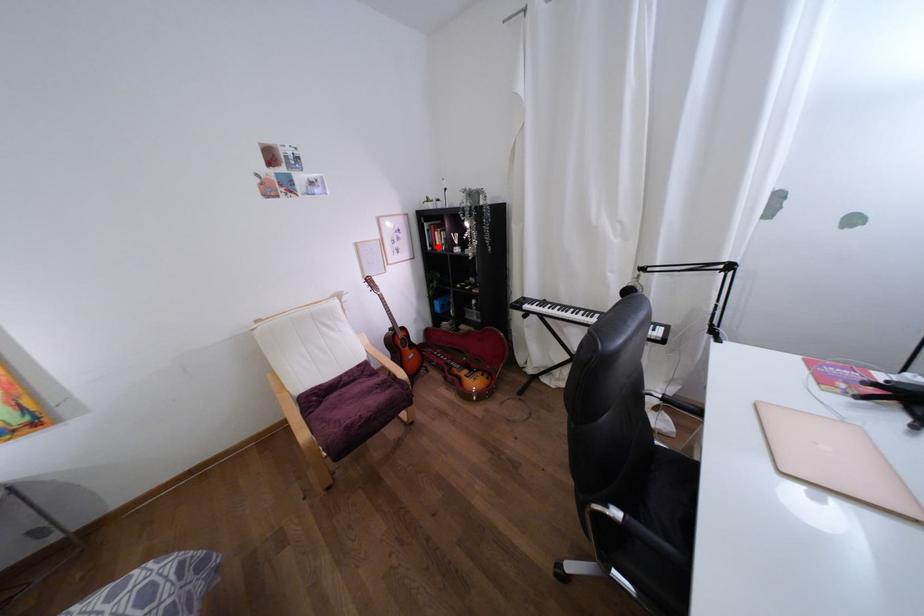
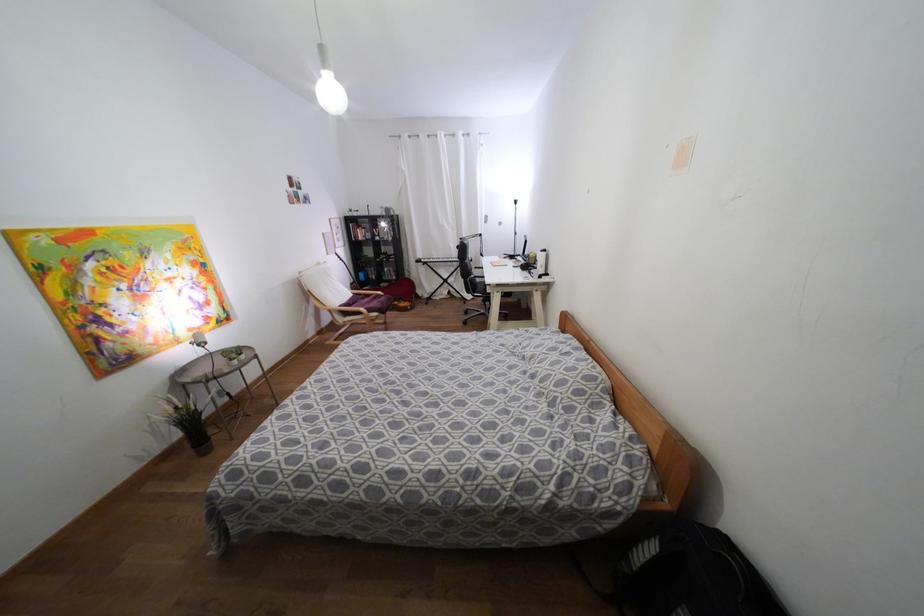
Question: I am providing you with two images of the same scene from different viewpoints. Given a red point in image1, look at the same physical point in image2. Is it:

Choices:
 (A) Closer to the viewpoint
 (B) Farther from the viewpoint

Answer: (A)